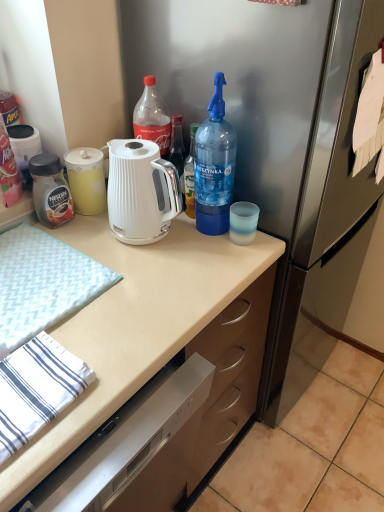
Locate an element on the screen. The height and width of the screenshot is (512, 384). space that is in front of blue translucent bottle at right, the third bottle in the left-to-right sequence is located at coordinates (208, 264).